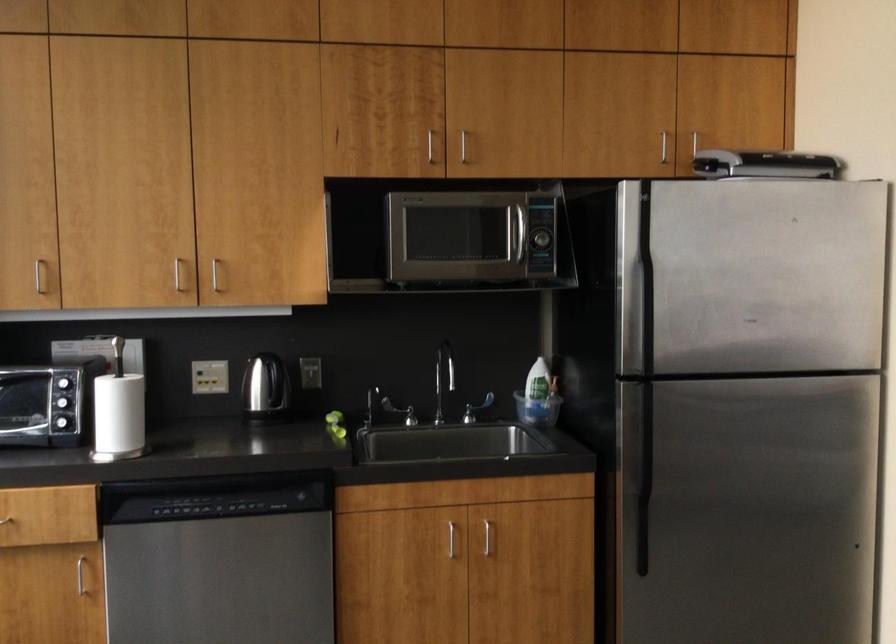
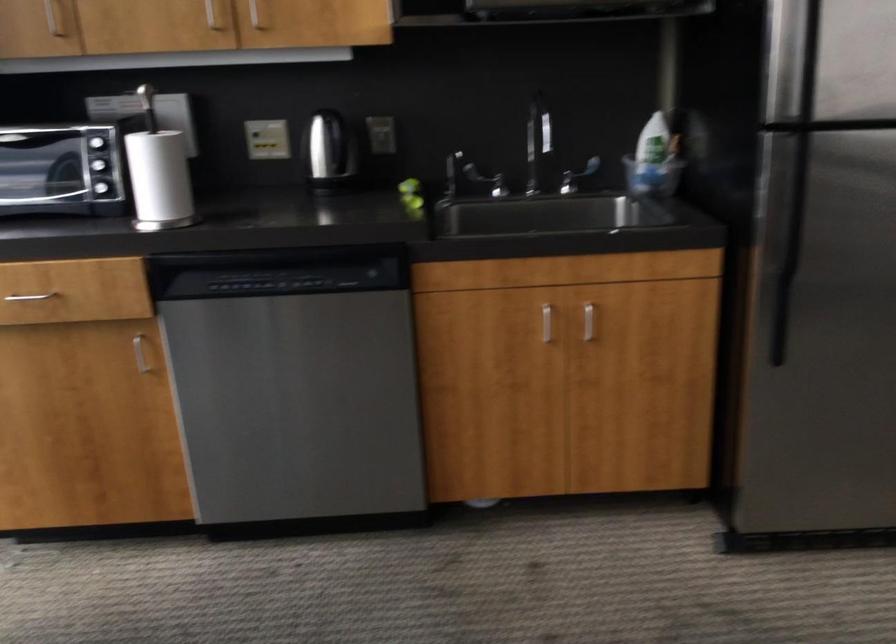
In the second image, find the point that corresponds to point (536, 393) in the first image.

(650, 155)